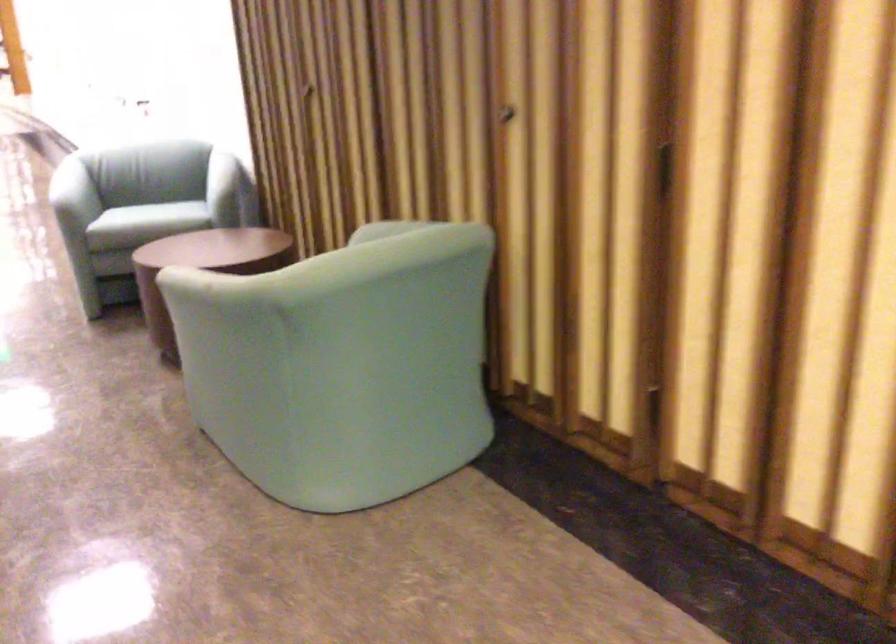
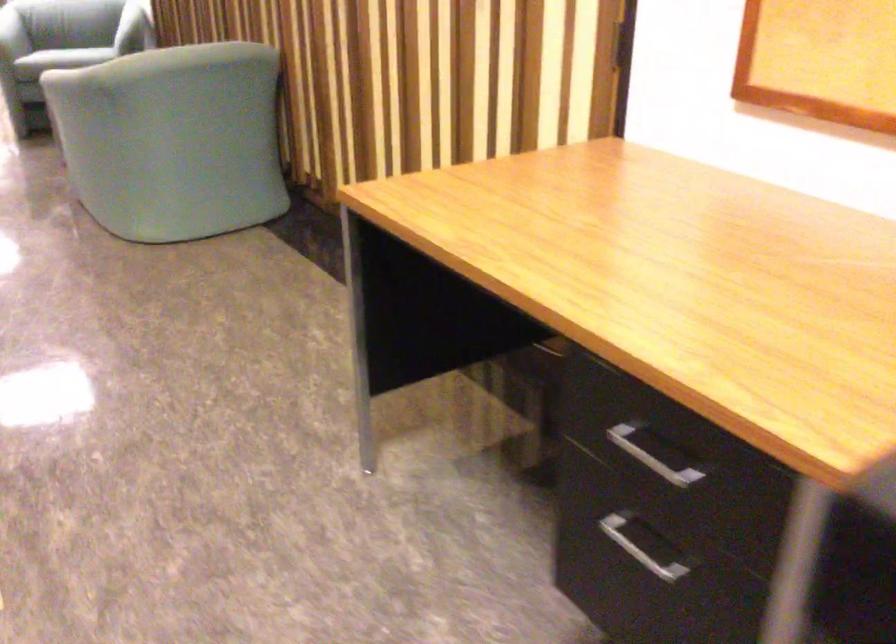
Locate, in the second image, the point that corresponds to [181,238] in the first image.

(66, 57)